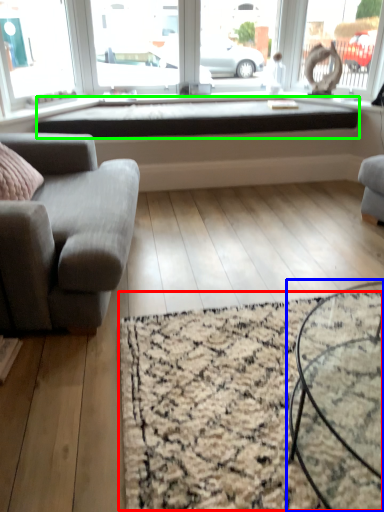
Question: Which is farther away from mat (highlighted by a red box)? coffee table (highlighted by a blue box) or window sill (highlighted by a green box)?

Choices:
 (A) coffee table
 (B) window sill

Answer: (B)